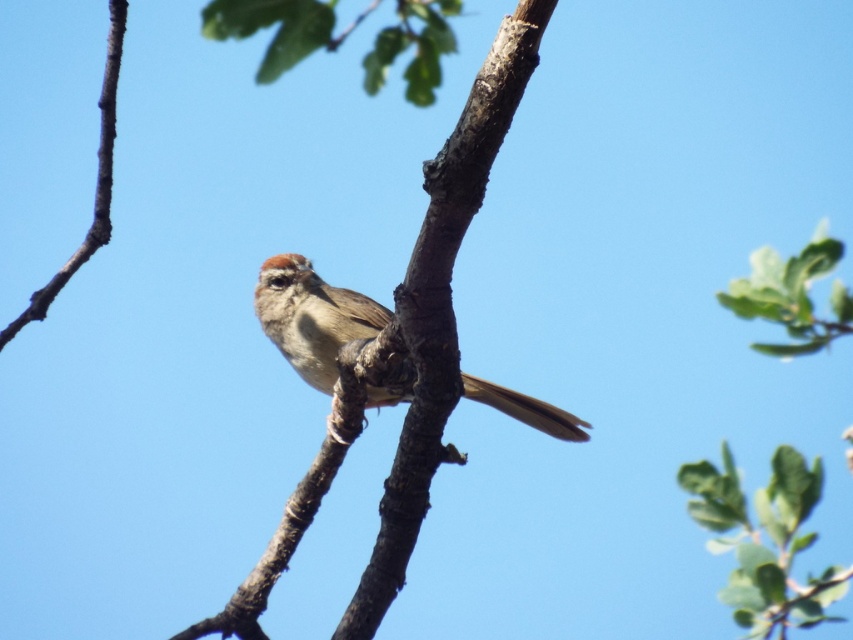
Question: Which object is closer to the camera taking this photo?

Choices:
 (A) brown speckled sparrow at center
 (B) brown rough branch at center

Answer: (B)

Question: Among these points, which one is farthest from the camera?

Choices:
 (A) (258, 630)
 (B) (751, 536)
 (C) (289, 305)

Answer: (C)

Question: Observing the image, what is the correct spatial positioning of brown rough branch at center in reference to green leafy branch at upper right?

Choices:
 (A) left
 (B) right

Answer: (A)

Question: Does green leafy branch at upper right appear over brown speckled sparrow at center?

Choices:
 (A) yes
 (B) no

Answer: (B)

Question: Estimate the real-world distances between objects in this image. Which object is farther from the brown speckled sparrow at center?

Choices:
 (A) brown rough branch at center
 (B) green leafy branch at upper right

Answer: (B)

Question: From the image, what is the correct spatial relationship of brown rough branch at center in relation to brown speckled sparrow at center?

Choices:
 (A) below
 (B) above

Answer: (A)